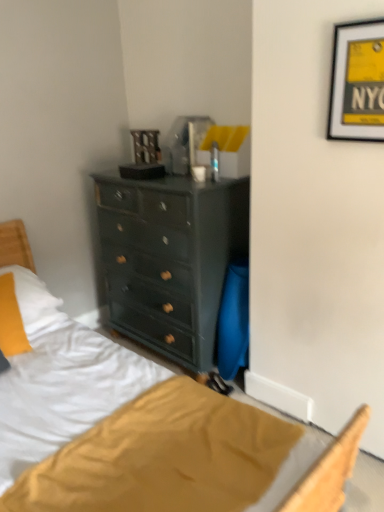
Question: Is black matte picture frame at upper right in front of soft yellow pillow at lower left?

Choices:
 (A) no
 (B) yes

Answer: (B)

Question: Is black matte picture frame at upper right far away from soft yellow pillow at lower left?

Choices:
 (A) yes
 (B) no

Answer: (A)

Question: From the image's perspective, is black matte picture frame at upper right on top of soft yellow pillow at lower left?

Choices:
 (A) no
 (B) yes

Answer: (B)

Question: From a real-world perspective, is black matte picture frame at upper right under soft yellow pillow at lower left?

Choices:
 (A) no
 (B) yes

Answer: (A)

Question: Could you tell me if black matte picture frame at upper right is turned towards soft yellow pillow at lower left?

Choices:
 (A) yes
 (B) no

Answer: (B)

Question: Is black matte picture frame at upper right to the left of soft yellow pillow at lower left from the viewer's perspective?

Choices:
 (A) no
 (B) yes

Answer: (A)

Question: Considering the relative sizes of soft yellow pillow at lower left and black matte picture frame at upper right in the image provided, is soft yellow pillow at lower left wider than black matte picture frame at upper right?

Choices:
 (A) no
 (B) yes

Answer: (B)

Question: From a real-world perspective, is soft yellow pillow at lower left under black matte picture frame at upper right?

Choices:
 (A) no
 (B) yes

Answer: (B)

Question: Considering the relative sizes of soft yellow pillow at lower left and black matte picture frame at upper right in the image provided, is soft yellow pillow at lower left shorter than black matte picture frame at upper right?

Choices:
 (A) no
 (B) yes

Answer: (A)

Question: Is soft yellow pillow at lower left bigger than black matte picture frame at upper right?

Choices:
 (A) no
 (B) yes

Answer: (B)

Question: Considering the relative positions of soft yellow pillow at lower left and black matte picture frame at upper right in the image provided, is soft yellow pillow at lower left to the left of black matte picture frame at upper right from the viewer's perspective?

Choices:
 (A) no
 (B) yes

Answer: (B)

Question: Does soft yellow pillow at lower left lie behind black matte picture frame at upper right?

Choices:
 (A) yes
 (B) no

Answer: (A)

Question: Considering the positions of black matte picture frame at upper right and soft yellow pillow at lower left in the image, is black matte picture frame at upper right taller or shorter than soft yellow pillow at lower left?

Choices:
 (A) short
 (B) tall

Answer: (A)